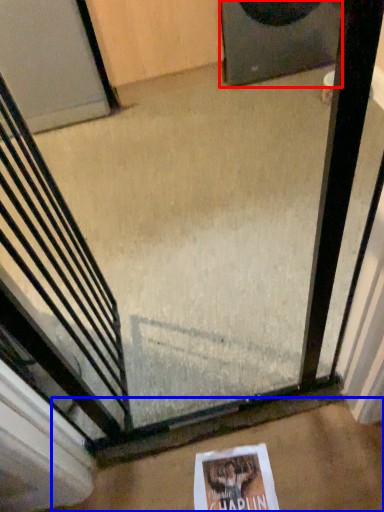
Question: Which object appears closest to the camera in this image, speaker (highlighted by a red box) or concrete (highlighted by a blue box)?

Choices:
 (A) speaker
 (B) concrete

Answer: (B)